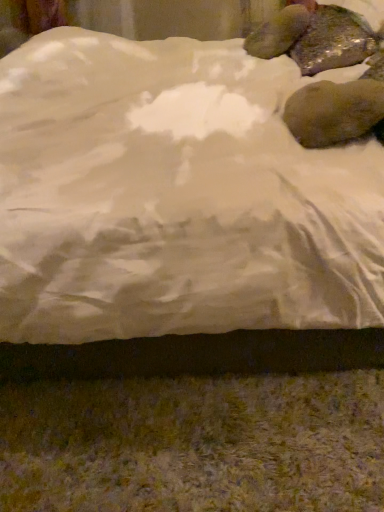
Question: From the image's perspective, is brown matte rock at upper right above or below white satin bed at center?

Choices:
 (A) above
 (B) below

Answer: (B)

Question: Is brown matte rock at upper right spatially inside white satin bed at center, or outside of it?

Choices:
 (A) outside
 (B) inside

Answer: (B)

Question: Considering the relative positions of brown matte rock at upper right and white satin bed at center in the image provided, is brown matte rock at upper right to the left or to the right of white satin bed at center?

Choices:
 (A) left
 (B) right

Answer: (B)

Question: Is point (29, 246) positioned closer to the camera than point (357, 39)?

Choices:
 (A) closer
 (B) farther

Answer: (A)

Question: Do you think white satin bed at center is within brown matte rock at upper right, or outside of it?

Choices:
 (A) inside
 (B) outside

Answer: (B)

Question: Is white satin bed at center in front of or behind brown matte rock at upper right in the image?

Choices:
 (A) front
 (B) behind

Answer: (A)

Question: Considering the positions of white satin bed at center and brown matte rock at upper right in the image, is white satin bed at center taller or shorter than brown matte rock at upper right?

Choices:
 (A) tall
 (B) short

Answer: (A)